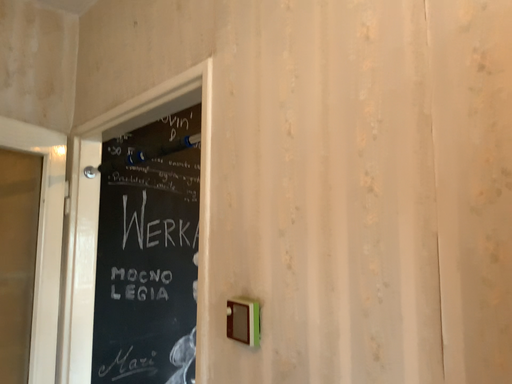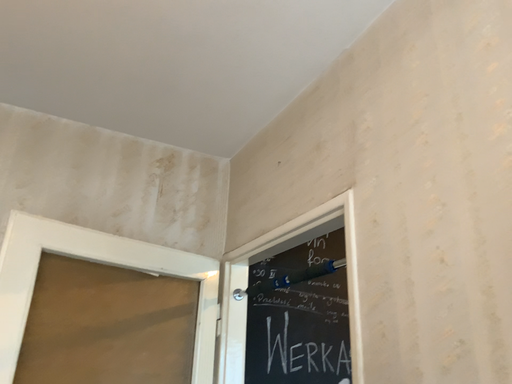
Question: Which way did the camera rotate in the video?

Choices:
 (A) rotated right
 (B) rotated left

Answer: (B)